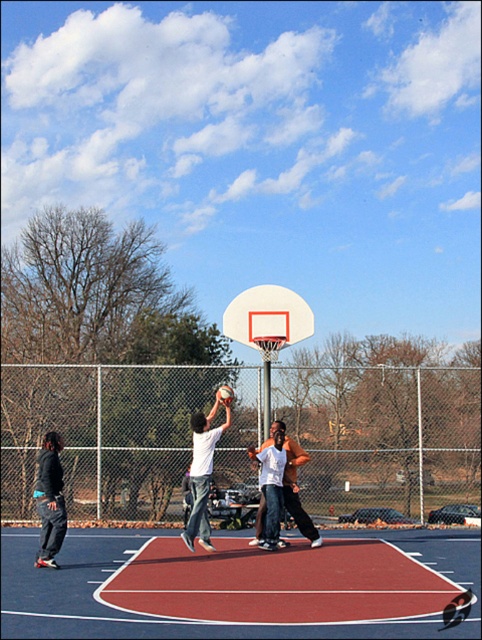
You are a referee standing at the edge of the court. You need to retrieve both the white matte basketball at center and the dark gray hoodie at left to check for equipment compliance. Given that you can only carry one item at a time, which item should you pick up first to minimize the total distance walked?

You should pick up the dark gray hoodie at left first because it is closer to your starting position at the edge of the court. After retrieving it, you can then walk to the white matte basketball at center, which is 2.00 meters away from the hoodie. This minimizes the total distance compared to picking up the basketball first, which would require walking back to the hoodie afterward.

You are planning to place a new bench on the basketball court. The bench requires a space wider than the dark gray hoodie at left. Can the rubberized red basketball court at center accommodate the bench?

The rubberized red basketball court at center is wider than the dark gray hoodie at left. Therefore, the bench requiring a space wider than the dark gray hoodie at left can be accommodated on the rubberized red basketball court at center.